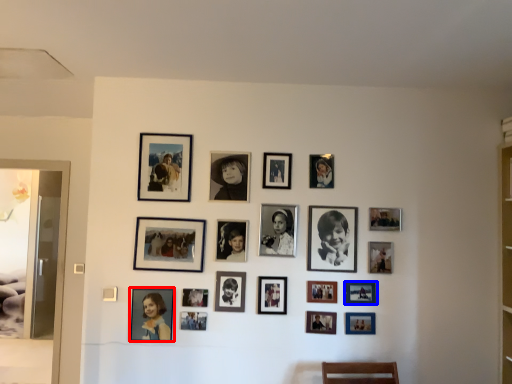
Question: Which object appears closest to the camera in this image, picture frame (highlighted by a red box) or picture frame (highlighted by a blue box)?

Choices:
 (A) picture frame
 (B) picture frame

Answer: (A)